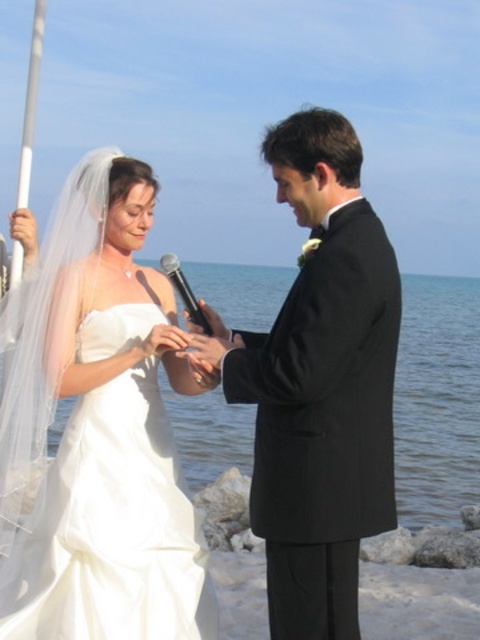
Who is more distant from viewer, (35, 580) or (195, 330)?

Point (195, 330)

Looking at this image, does white satin dress at center have a lesser height compared to black matte microphone at center?

Incorrect, white satin dress at center's height does not fall short of black matte microphone at center's.

Identify the location of white satin dress at center. [x=97, y=429].

Between black satin suit at center and black matte microphone at center, which one is positioned lower?

black satin suit at center

Does black satin suit at center have a smaller size compared to black matte microphone at center?

No, black satin suit at center is not smaller than black matte microphone at center.

Locate an element on the screen. Image resolution: width=480 pixels, height=640 pixels. black satin suit at center is located at coordinates (320, 385).

Is white satin dress at center taller than black satin suit at center?

Incorrect, white satin dress at center's height is not larger of black satin suit at center's.

Between point (137, 294) and point (272, 346), which one is positioned in front?

Point (272, 346)

Which is in front, point (15, 554) or point (314, 138)?

Point (314, 138) is in front.

The width and height of the screenshot is (480, 640). I want to click on white satin dress at center, so click(97, 429).